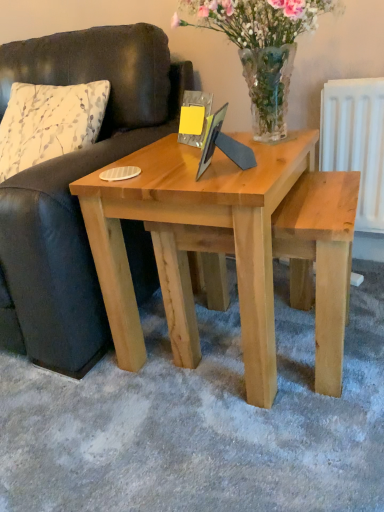
Where is `clear glass vase at center`? clear glass vase at center is located at coordinates (261, 47).

The image size is (384, 512). Identify the location of clear glass vase at center. (261, 47).

Between clear glass vase at center and natural wood coffee table at center, which one has smaller size?

clear glass vase at center is smaller.

Is clear glass vase at center turned away from natural wood coffee table at center?

clear glass vase at center does not have its back to natural wood coffee table at center.

From a real-world perspective, is clear glass vase at center physically above natural wood coffee table at center?

Indeed, from a real-world perspective, clear glass vase at center stands above natural wood coffee table at center.

From the image's perspective, is natural wood coffee table at center located above or below clear glass vase at center?

natural wood coffee table at center is situated lower than clear glass vase at center in the image.

Is clear glass vase at center at the back of natural wood coffee table at center?

No, natural wood coffee table at center is not facing the opposite direction of clear glass vase at center.

Identify the location of coffee table below the clear glass vase at center (from the image's perspective). This screenshot has width=384, height=512. (229, 248).

Which is more to the left, natural wood coffee table at center or clear glass vase at center?

Positioned to the left is natural wood coffee table at center.

Is white printed fabric pillow at left aimed at clear glass vase at center?

No, white printed fabric pillow at left is not oriented towards clear glass vase at center.

The width and height of the screenshot is (384, 512). Find the location of `pillow below the clear glass vase at center (from a real-world perspective)`. pillow below the clear glass vase at center (from a real-world perspective) is located at coordinates (49, 123).

Between white printed fabric pillow at left and clear glass vase at center, which one has smaller size?

clear glass vase at center.

In the scene shown: Looking at their sizes, would you say white printed fabric pillow at left is wider or thinner than clear glass vase at center?

white printed fabric pillow at left is wider than clear glass vase at center.

From the image's perspective, which one is positioned higher, natural wood coffee table at center or leather couch at left?

leather couch at left is shown above in the image.

Does point (358, 172) appear closer or farther from the camera than point (145, 56)?

Clearly, point (358, 172) is closer to the camera than point (145, 56).

Can you confirm if natural wood coffee table at center is taller than leather couch at left?

Incorrect, the height of natural wood coffee table at center is not larger of that of leather couch at left.

Is natural wood coffee table at center turned away from leather couch at left?

natural wood coffee table at center does not have its back to leather couch at left.

Based on the photo, considering the sizes of objects natural wood coffee table at center and white printed fabric pillow at left in the image provided, who is thinner, natural wood coffee table at center or white printed fabric pillow at left?

With smaller width is white printed fabric pillow at left.

Which is more to the right, natural wood coffee table at center or white printed fabric pillow at left?

natural wood coffee table at center.

Would you say white printed fabric pillow at left is part of natural wood coffee table at center's contents?

Actually, white printed fabric pillow at left is outside natural wood coffee table at center.

Is natural wood coffee table at center far from white printed fabric pillow at left?

That's not correct — natural wood coffee table at center is a little close to white printed fabric pillow at left.

In the scene shown: Is leather couch at left in contact with natural wood coffee table at center?

No, leather couch at left is not making contact with natural wood coffee table at center.

From a real-world perspective, is leather couch at left under natural wood coffee table at center?

Incorrect, from a real-world perspective, leather couch at left is higher than natural wood coffee table at center.

Does leather couch at left have a smaller size compared to natural wood coffee table at center?

No, leather couch at left is not smaller than natural wood coffee table at center.

Is leather couch at left looking in the opposite direction of clear glass vase at center?

No, leather couch at left is not facing away from clear glass vase at center.

Is leather couch at left not close to clear glass vase at center?

No.

The height and width of the screenshot is (512, 384). Identify the location of studio couch in front of the clear glass vase at center. (74, 180).

From the image's perspective, is leather couch at left located beneath clear glass vase at center?

Yes.

Image resolution: width=384 pixels, height=512 pixels. In the image, there is a clear glass vase at center. In order to click on coffee table below it (from a real-world perspective) in this screenshot , I will do `click(229, 248)`.

I want to click on coffee table located on the left of clear glass vase at center, so click(229, 248).

When comparing their distances from leather couch at left, does clear glass vase at center or natural wood coffee table at center seem closer?

natural wood coffee table at center.

Based on their spatial positions, is leather couch at left or clear glass vase at center further from natural wood coffee table at center?

clear glass vase at center is positioned further to the anchor natural wood coffee table at center.

Based on their spatial positions, is clear glass vase at center or white printed fabric pillow at left further from natural wood coffee table at center?

white printed fabric pillow at left.

Considering their positions, is white printed fabric pillow at left positioned closer to clear glass vase at center than leather couch at left?

Among the two, leather couch at left is located nearer to clear glass vase at center.

Which object lies further to the anchor point clear glass vase at center, leather couch at left or natural wood coffee table at center?

Among the two, leather couch at left is located further to clear glass vase at center.

Based on their spatial positions, is natural wood coffee table at center or leather couch at left closer to white printed fabric pillow at left?

The object closer to white printed fabric pillow at left is leather couch at left.

Estimate the real-world distances between objects in this image. Which object is closer to leather couch at left, white printed fabric pillow at left or clear glass vase at center?

The object closer to leather couch at left is white printed fabric pillow at left.

When comparing their distances from white printed fabric pillow at left, does leather couch at left or clear glass vase at center seem further?

Among the two, clear glass vase at center is located further to white printed fabric pillow at left.

Where is `pillow between leather couch at left and natural wood coffee table at center from left to right`? Image resolution: width=384 pixels, height=512 pixels. pillow between leather couch at left and natural wood coffee table at center from left to right is located at coordinates (49, 123).

This screenshot has width=384, height=512. Find the location of `pillow located between leather couch at left and clear glass vase at center in the left-right direction`. pillow located between leather couch at left and clear glass vase at center in the left-right direction is located at coordinates (49, 123).

The image size is (384, 512). What are the coordinates of `coffee table between leather couch at left and clear glass vase at center from left to right` in the screenshot? It's located at (229, 248).

Locate an element on the screen. Image resolution: width=384 pixels, height=512 pixels. coffee table between white printed fabric pillow at left and clear glass vase at center in the horizontal direction is located at coordinates (229, 248).